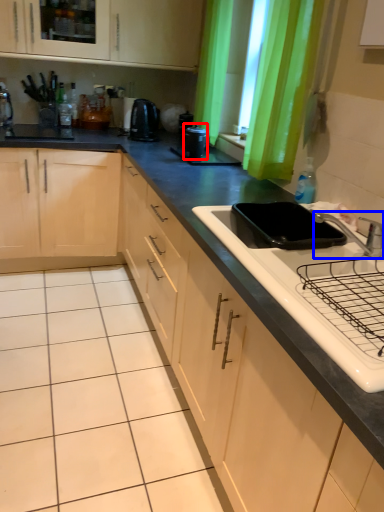
Question: Which object is further to the camera taking this photo, kitchen appliance (highlighted by a red box) or tap (highlighted by a blue box)?

Choices:
 (A) kitchen appliance
 (B) tap

Answer: (A)